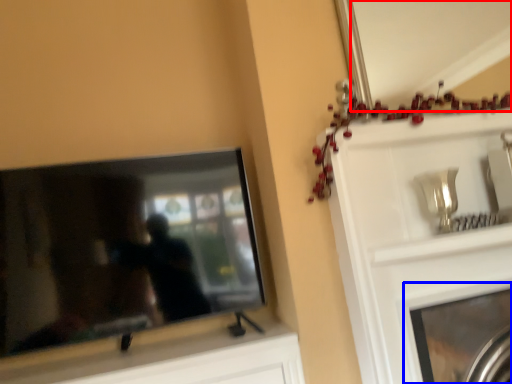
Question: Which point is closer to the camera, mirror (highlighted by a red box) or fireplace (highlighted by a blue box)?

Choices:
 (A) mirror
 (B) fireplace

Answer: (B)